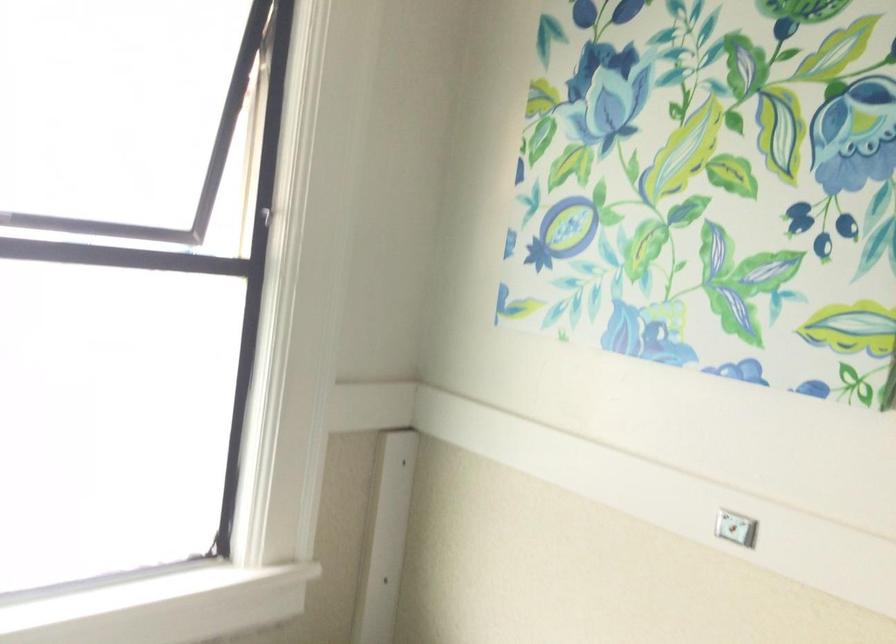
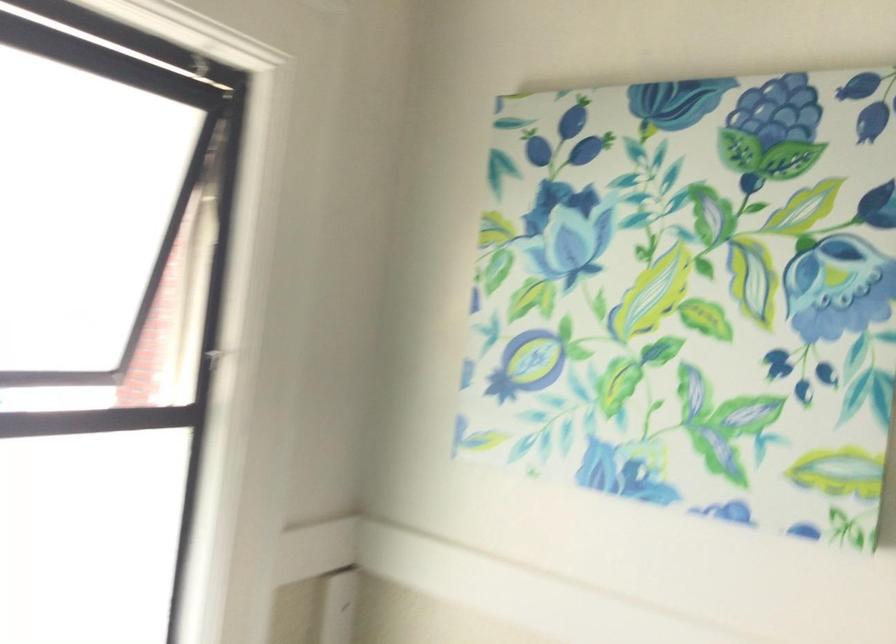
The point at (718, 149) is marked in the first image. Where is the corresponding point in the second image?

(693, 292)